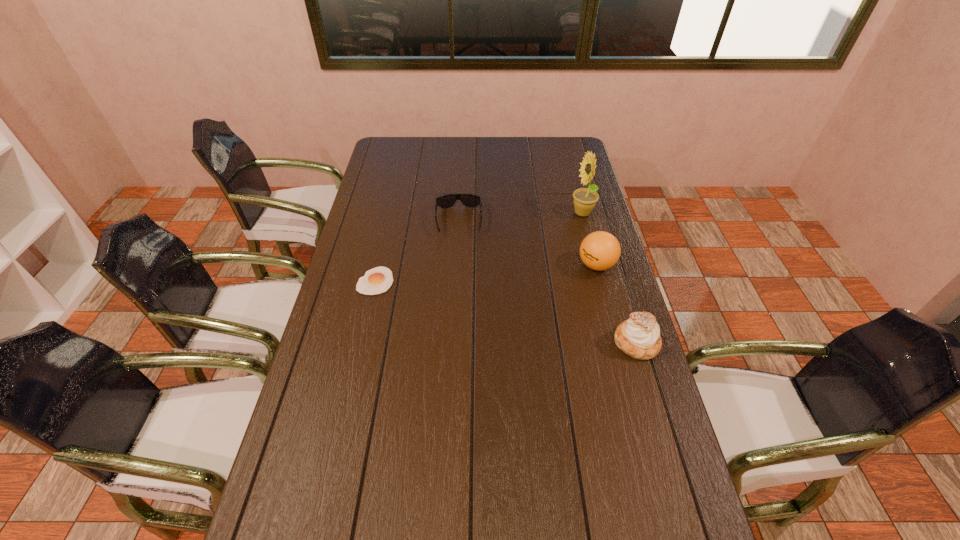
Identify the location of free spot on the desktop that is between the egg yolk and the nearest object and is positioned on the side with brand of the ping-pong ball. (473, 304).

Find the location of a particular element. Image resolution: width=960 pixels, height=540 pixels. vacant spot on the desktop that is between the leftmost object and the nearest object and is positioned on the front-facing side of the fourth object from right to left is located at coordinates (461, 301).

Find the location of a particular element. This screenshot has width=960, height=540. vacant spot on the desktop that is between the leftmost object and the pastry and is positioned on the face of the sunflower is located at coordinates (464, 302).